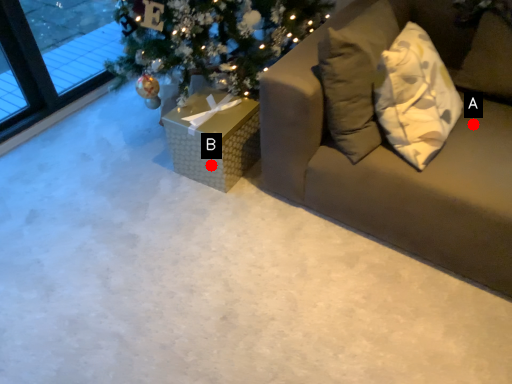
Question: Two points are circled on the image, labeled by A and B beside each circle. Which of the following is the farthest from the observer?

Choices:
 (A) A is further
 (B) B is further

Answer: (B)